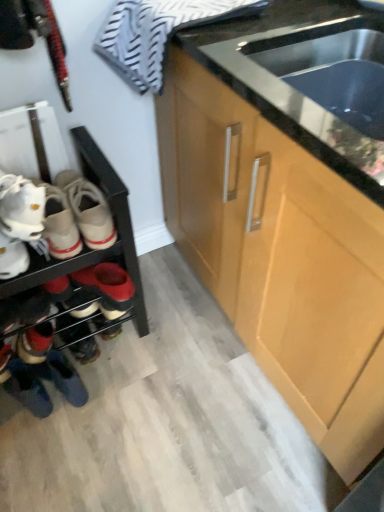
At what (x,y) coordinates should I click in order to perform the action: click on vacant area that lies to the right of black matte shoe rack at left. Please return your answer as a coordinate pair (x, y). The width and height of the screenshot is (384, 512). Looking at the image, I should click on (174, 364).